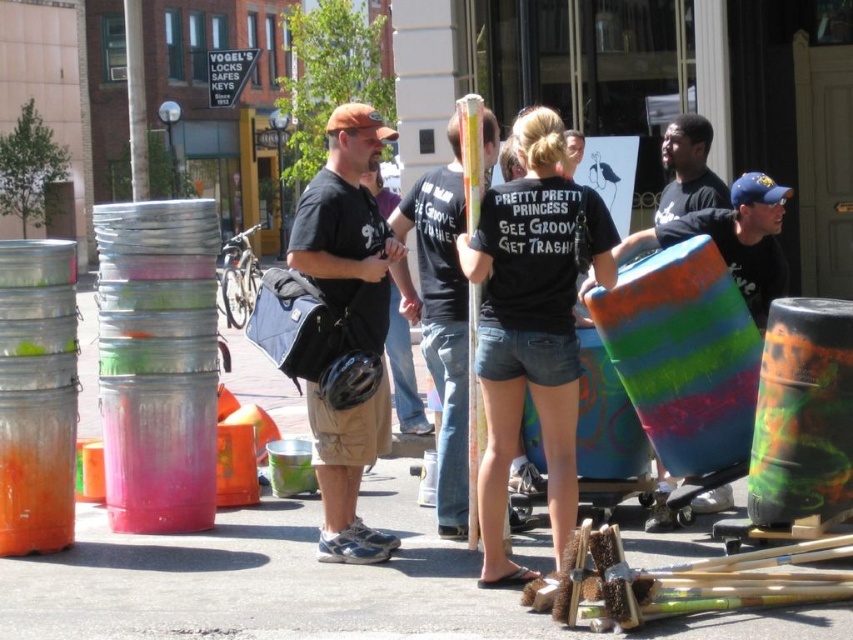
Question: Which point is closer to the camera taking this photo?

Choices:
 (A) (758, 264)
 (B) (496, 525)
 (C) (460, 339)
 (D) (503, 612)

Answer: (D)

Question: Is smooth concrete pavement at center thinner than black t-shirt at center?

Choices:
 (A) no
 (B) yes

Answer: (A)

Question: Which point is farther to the camera?

Choices:
 (A) black t-shirt at center
 (B) smooth concrete pavement at center
 (C) black matte t-shirt at center
 (D) matte black t-shirt at center

Answer: (D)

Question: Among these objects, which one is farthest from the camera?

Choices:
 (A) black cotton shirt at center
 (B) matte black t-shirt at center
 (C) smooth concrete pavement at center

Answer: (B)

Question: Can you confirm if black matte t-shirt at center is positioned to the right of multicolored painted drum at center?

Choices:
 (A) no
 (B) yes

Answer: (A)

Question: Does smooth concrete pavement at center appear on the right side of matte black t-shirt at center?

Choices:
 (A) no
 (B) yes

Answer: (A)